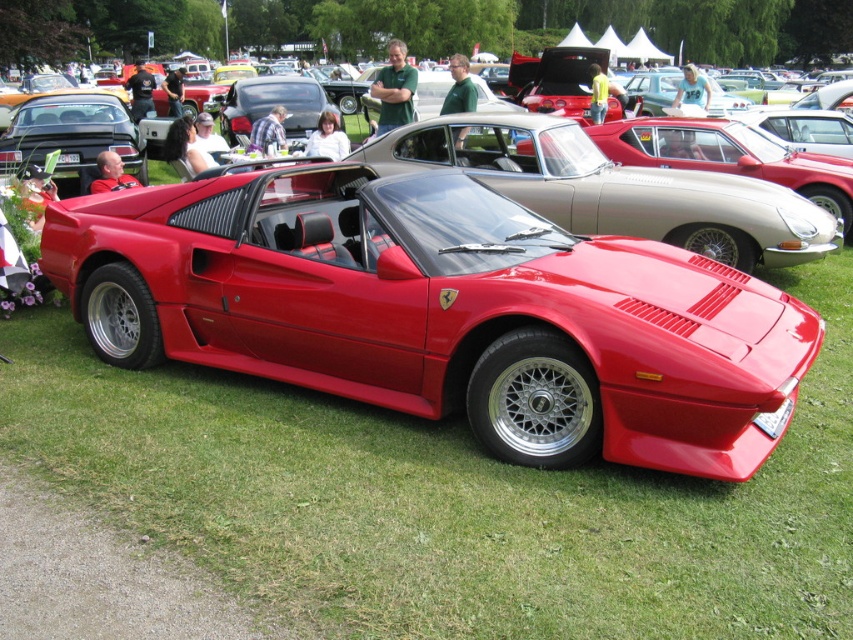
Is shiny red sports car at center above metallic silver convertible at center?

No, shiny red sports car at center is not above metallic silver convertible at center.

Is shiny red sports car at center closer to the viewer compared to metallic silver convertible at center?

Yes, shiny red sports car at center is in front of metallic silver convertible at center.

Is point (219, 317) positioned before point (728, 193)?

Yes, it is in front of point (728, 193).

Find the location of a particular element. shiny red sports car at center is located at coordinates click(x=440, y=310).